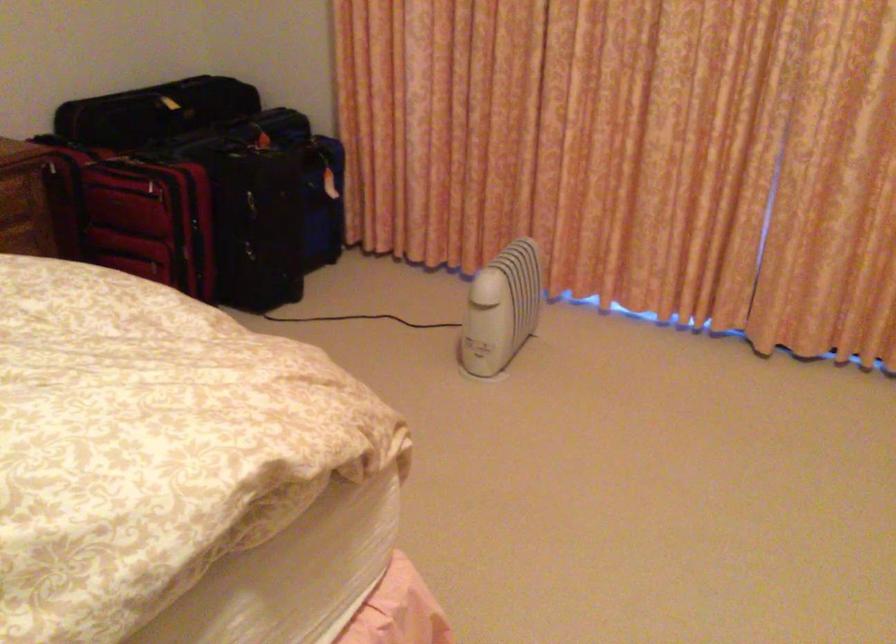
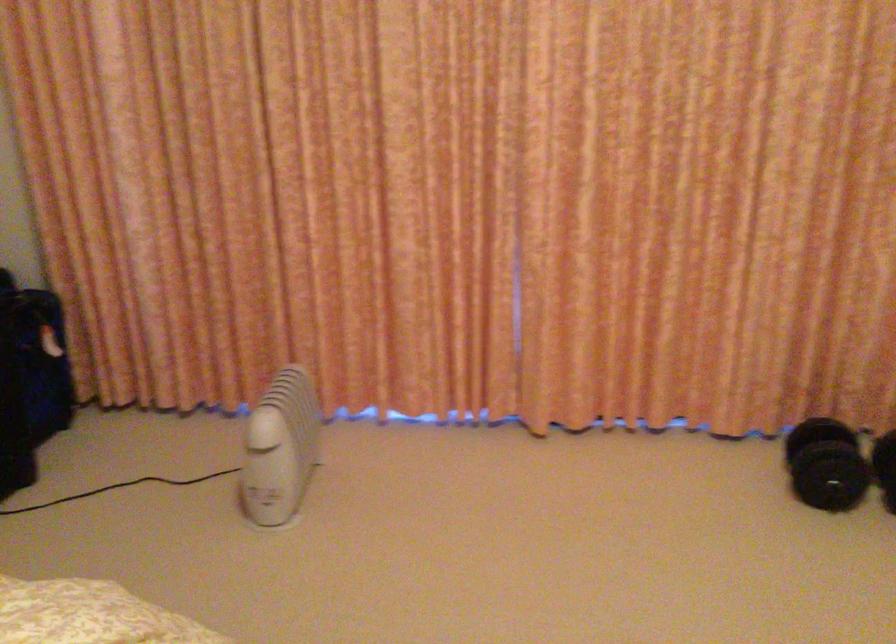
Question: The camera is either moving clockwise (left) or counter-clockwise (right) around the object. The first image is from the beginning of the video and the second image is from the end. Is the camera moving left or right when shooting the video?

Choices:
 (A) Left
 (B) Right

Answer: (A)